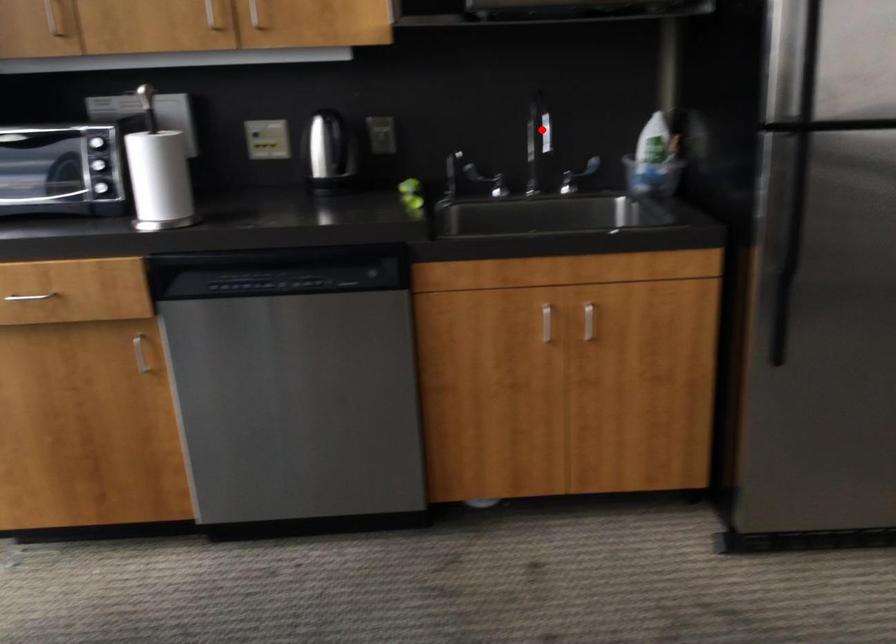
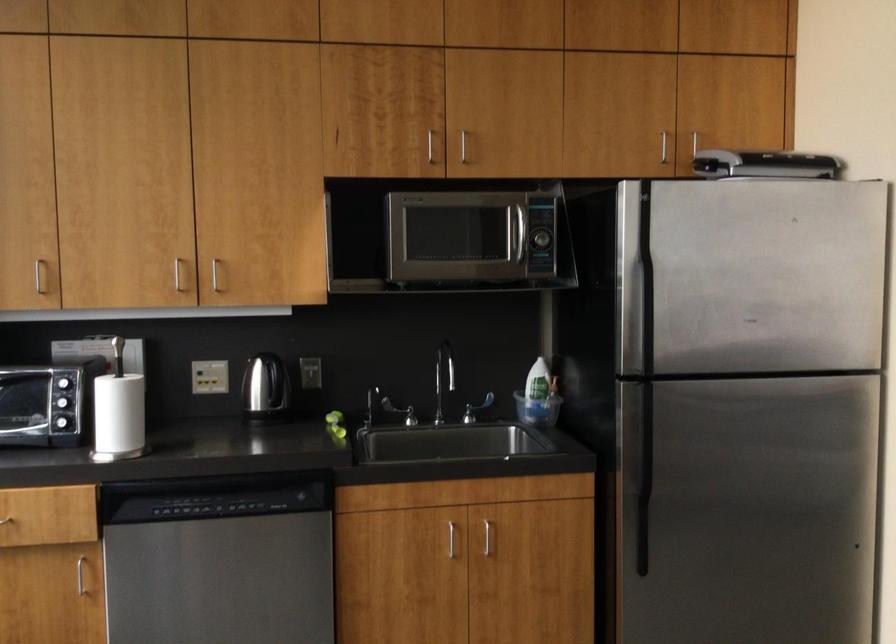
Question: I am providing you with two images of the same scene from different viewpoints. In image1, a red point is highlighted. Considering the same 3D point in image2, which of the following is correct?

Choices:
 (A) It is closer
 (B) It is farther

Answer: (B)